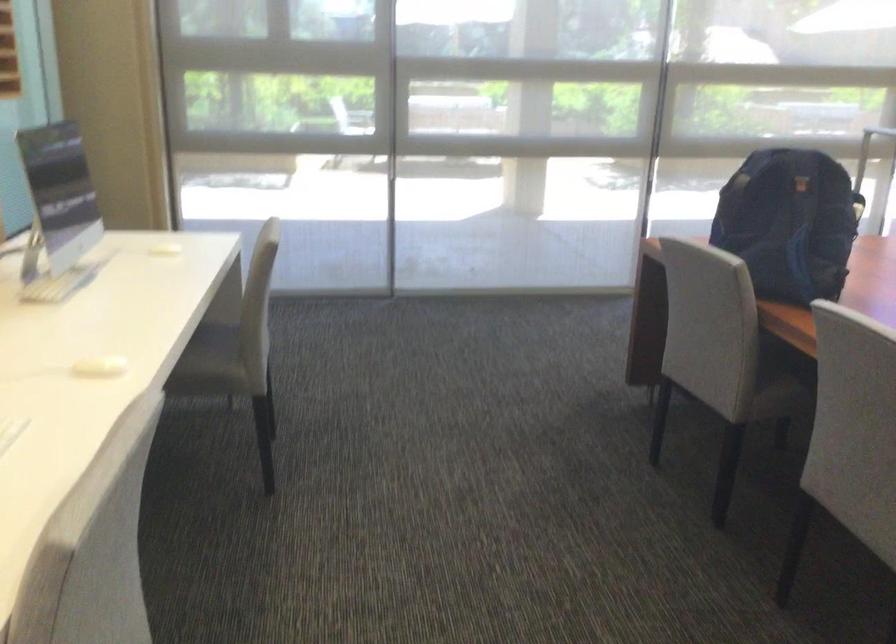
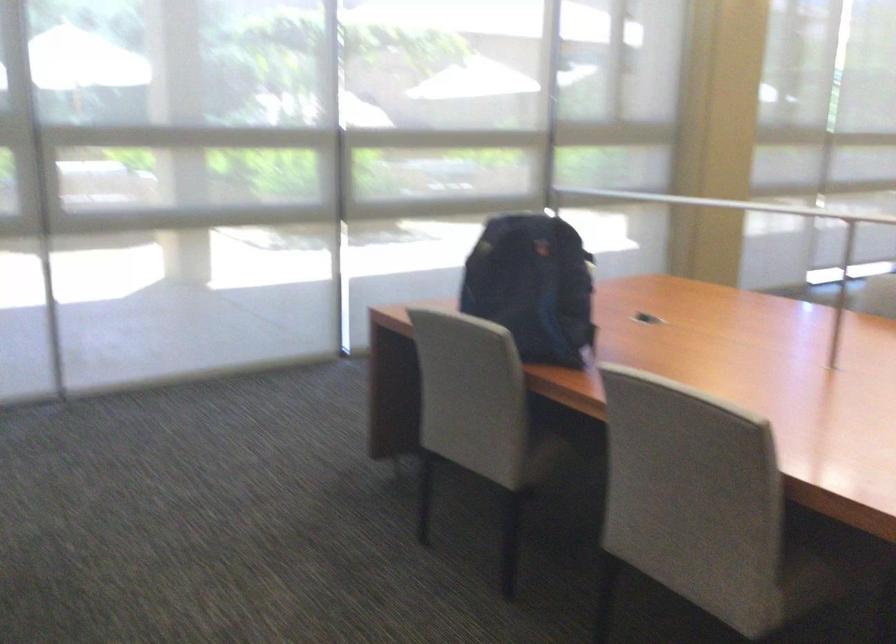
In the scene shown: The images are taken continuously from a first-person perspective. In which direction are you moving?

The cameraman moved toward left, forward.